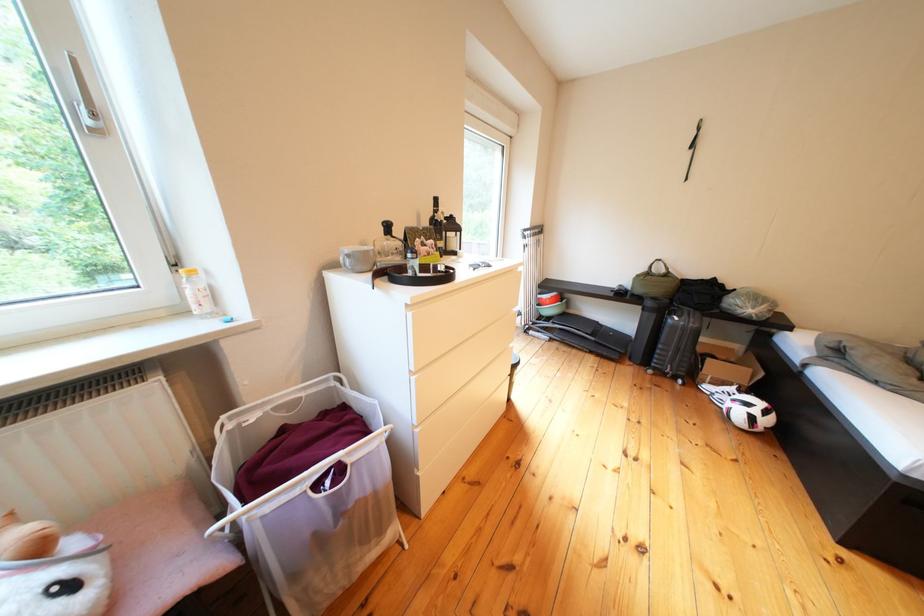
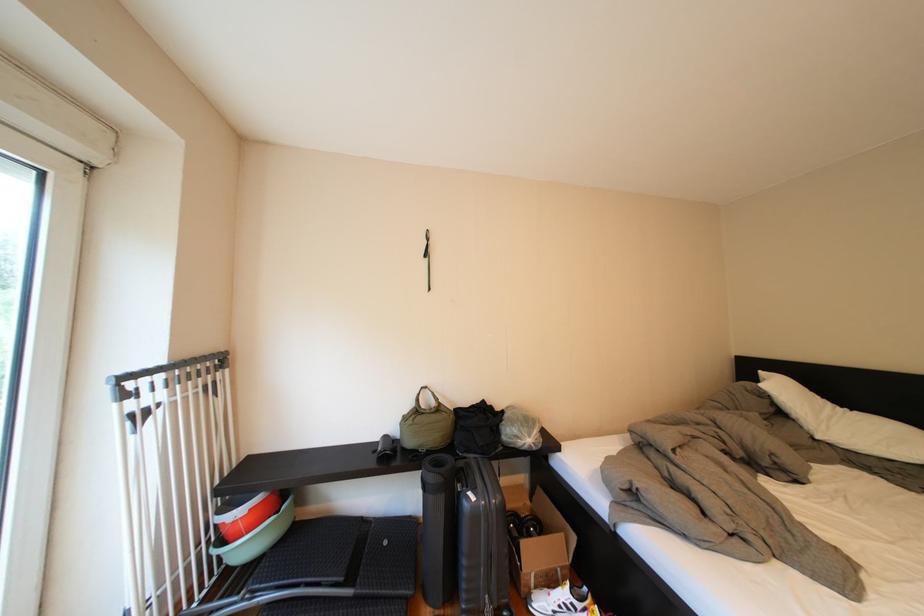
In the second image, find the point that corresponds to point (723, 392) in the first image.

(554, 609)